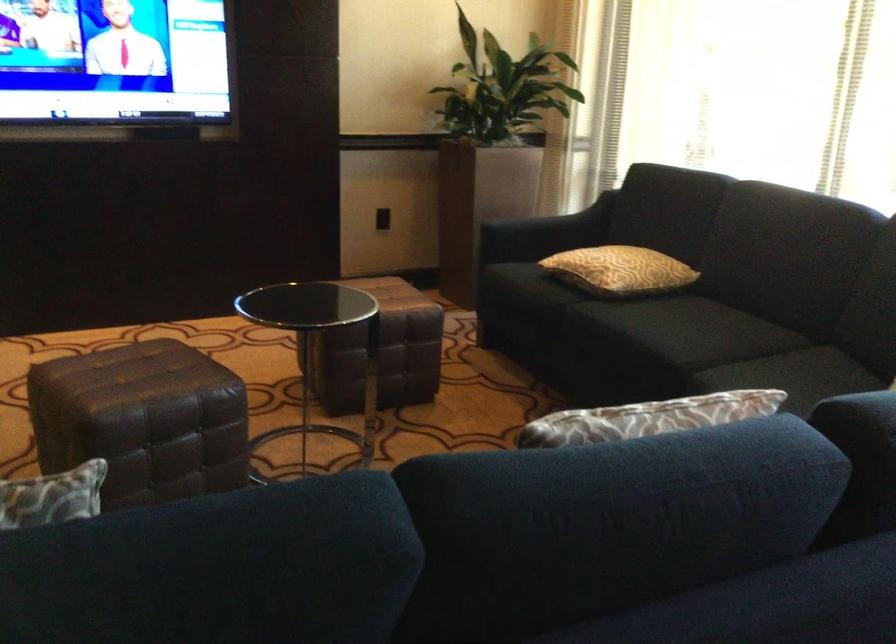
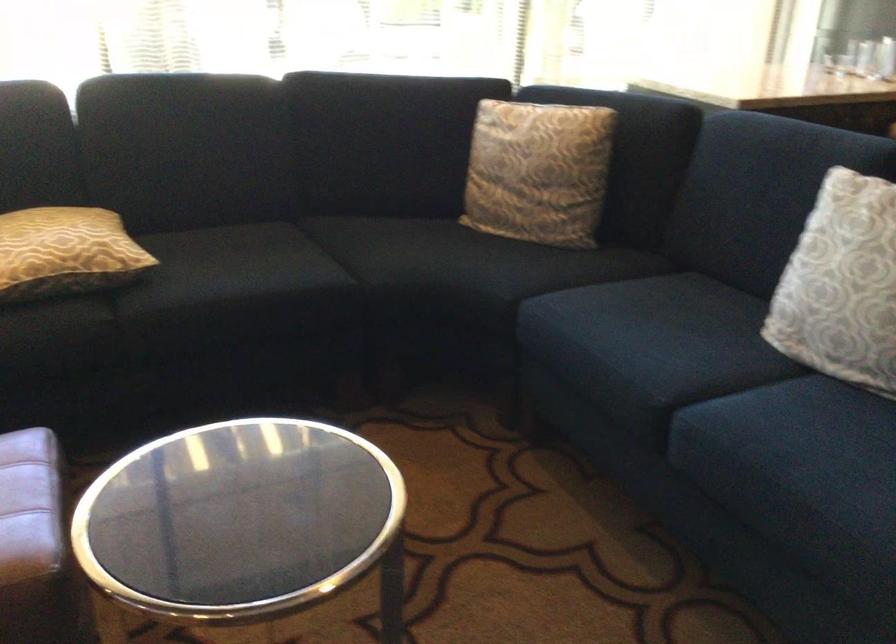
Locate, in the second image, the point that corresponds to point 746,375 in the first image.

(391, 261)